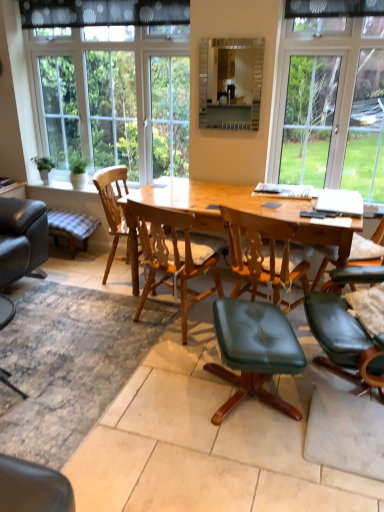
At what (x,y) coordinates should I click in order to perform the action: click on free point behind black plastic remote control at center. Please return your answer as a coordinate pair (x, y). This screenshot has width=384, height=512. Looking at the image, I should click on (303, 205).